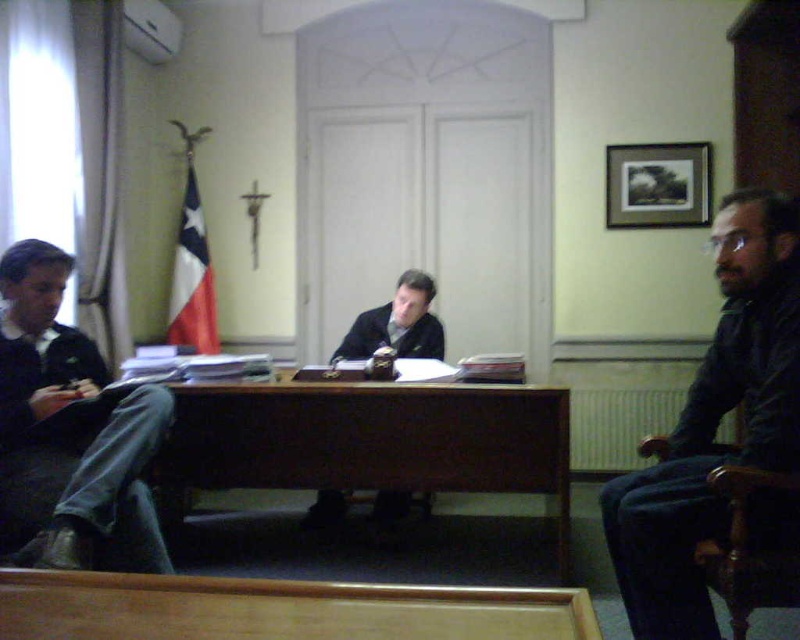
Question: Is brown wood table at center above dark brown leather shoes at center?

Choices:
 (A) yes
 (B) no

Answer: (B)

Question: Which point is closer to the camera?

Choices:
 (A) (694, 612)
 (B) (88, 497)
 (C) (564, 515)

Answer: (A)

Question: Can you confirm if brown wood table at center is positioned to the right of wooden chair at right?

Choices:
 (A) no
 (B) yes

Answer: (A)

Question: Which object appears closest to the camera in this image?

Choices:
 (A) wooden chair at right
 (B) dark blue jeans at left
 (C) dark brown leather shoes at center
 (D) brown wood table at center

Answer: (A)

Question: Which is nearer to the brown wood table at center?

Choices:
 (A) dark brown leather shoes at center
 (B) wooden chair at right
 (C) dark blue jeans at left

Answer: (C)

Question: Observing the image, what is the correct spatial positioning of brown wood table at center in reference to wooden chair at right?

Choices:
 (A) right
 (B) left

Answer: (B)